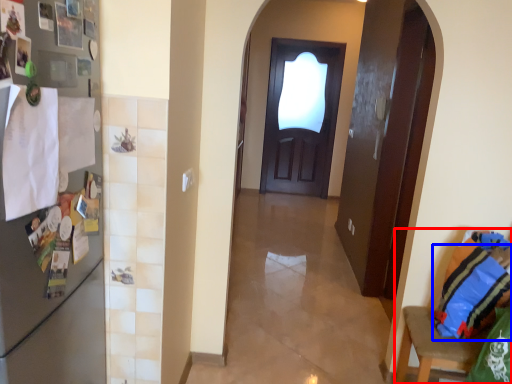
Question: Which object appears closest to the camera in this image, armchair (highlighted by a red box) or pillow (highlighted by a blue box)?

Choices:
 (A) armchair
 (B) pillow

Answer: (A)